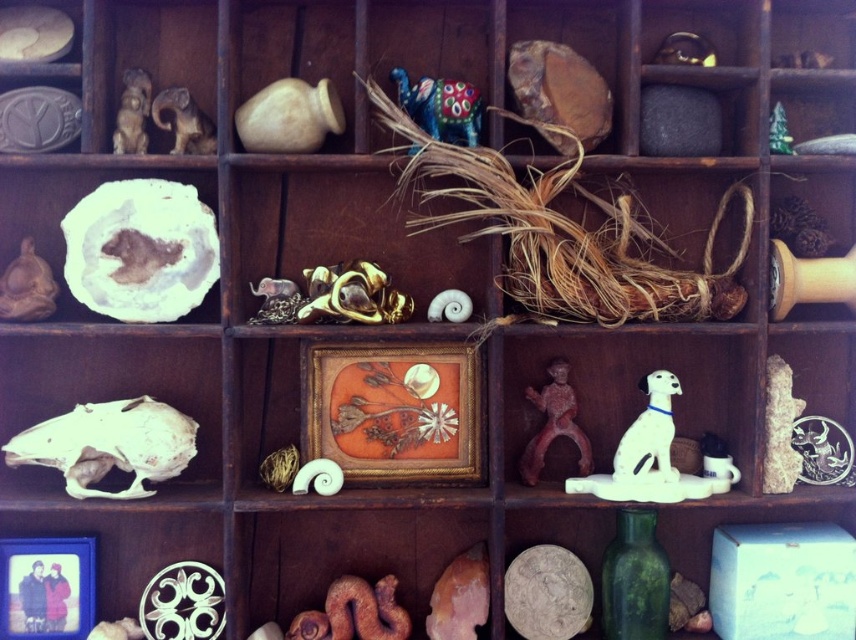
Question: Does white ceramic dog at center right have a smaller size compared to matte brown squirrel at upper left?

Choices:
 (A) no
 (B) yes

Answer: (A)

Question: Does green glass bottle at lower center have a larger size compared to shiny multicolored elephant at center?

Choices:
 (A) no
 (B) yes

Answer: (B)

Question: Does gold metallic jewelry at center have a smaller size compared to matte brown figurine at upper left?

Choices:
 (A) no
 (B) yes

Answer: (A)

Question: Estimate the real-world distances between objects in this image. Which object is farther from the brown matte snake at lower center?

Choices:
 (A) matte brown squirrel at upper left
 (B) matte blue photo frame at lower left
 (C) green glass bottle at lower center

Answer: (A)

Question: Among these points, which one is farthest from the camera?

Choices:
 (A) [x=209, y=134]
 (B) [x=63, y=452]
 (C) [x=296, y=320]

Answer: (A)

Question: Which point is closer to the camera taking this photo?

Choices:
 (A) (649, 564)
 (B) (69, 570)

Answer: (B)